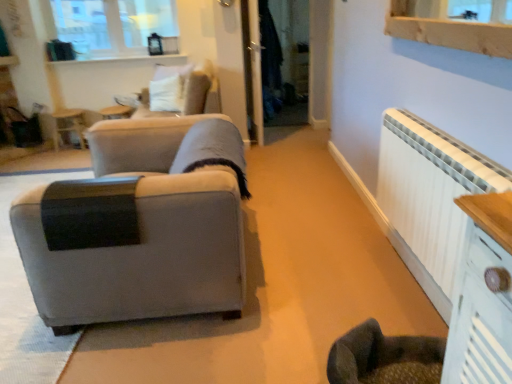
Question: Is matte gray fabric couch at left behind clear glass window at upper left?

Choices:
 (A) yes
 (B) no

Answer: (B)

Question: Can you confirm if matte gray fabric couch at left is thinner than clear glass window at upper left?

Choices:
 (A) yes
 (B) no

Answer: (B)

Question: Would you consider matte gray fabric couch at left to be distant from clear glass window at upper left?

Choices:
 (A) yes
 (B) no

Answer: (A)

Question: Is matte gray fabric couch at left taller than clear glass window at upper left?

Choices:
 (A) yes
 (B) no

Answer: (A)

Question: Does matte gray fabric couch at left touch clear glass window at upper left?

Choices:
 (A) no
 (B) yes

Answer: (A)

Question: From a real-world perspective, is matte gray fabric couch at left positioned above or below white glossy ledge at upper center?

Choices:
 (A) above
 (B) below

Answer: (B)

Question: Would you say matte gray fabric couch at left is to the left or to the right of white glossy ledge at upper center in the picture?

Choices:
 (A) right
 (B) left

Answer: (A)

Question: Is matte gray fabric couch at left bigger or smaller than white glossy ledge at upper center?

Choices:
 (A) small
 (B) big

Answer: (B)

Question: Considering the positions of point (98, 311) and point (61, 61), is point (98, 311) closer or farther from the camera than point (61, 61)?

Choices:
 (A) closer
 (B) farther

Answer: (A)

Question: Considering the positions of white painted radiator at right and velvet beige swivel chair at upper center in the image, is white painted radiator at right taller or shorter than velvet beige swivel chair at upper center?

Choices:
 (A) short
 (B) tall

Answer: (B)

Question: From the image's perspective, relative to velvet beige swivel chair at upper center, is white painted radiator at right above or below?

Choices:
 (A) below
 (B) above

Answer: (A)

Question: Considering the positions of white painted radiator at right and velvet beige swivel chair at upper center in the image, is white painted radiator at right wider or thinner than velvet beige swivel chair at upper center?

Choices:
 (A) thin
 (B) wide

Answer: (A)

Question: Considering the positions of point (388, 208) and point (151, 91), is point (388, 208) closer or farther from the camera than point (151, 91)?

Choices:
 (A) farther
 (B) closer

Answer: (B)

Question: From their relative heights in the image, would you say wooden side table at upper left is taller or shorter than clear glass window at upper left?

Choices:
 (A) short
 (B) tall

Answer: (A)

Question: Is point (70, 117) closer or farther from the camera than point (109, 34)?

Choices:
 (A) closer
 (B) farther

Answer: (A)